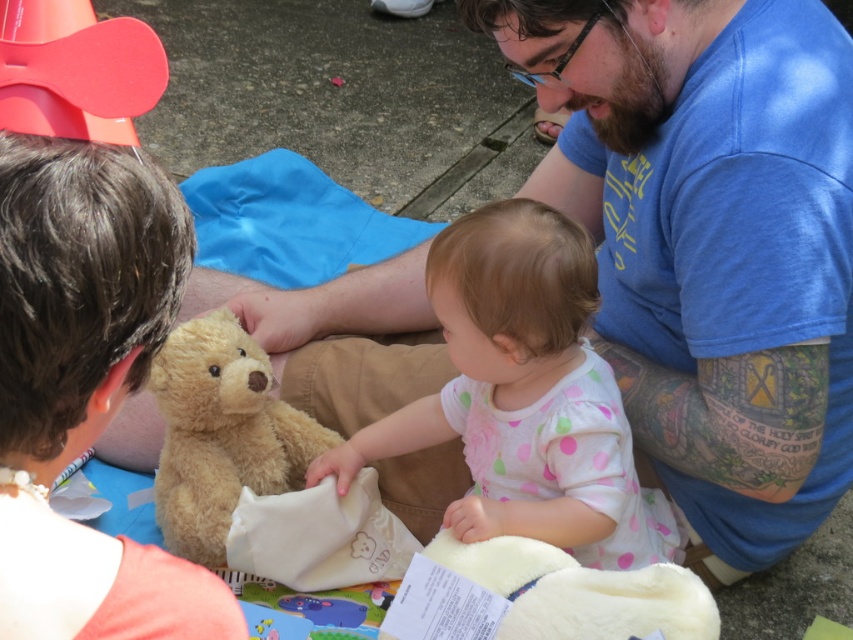
Does soft white fabric at center have a greater width compared to fuzzy beige teddy bear at center?

Yes, soft white fabric at center is wider than fuzzy beige teddy bear at center.

Does point (457, 276) lie in front of point (219, 387)?

Yes, it is in front of point (219, 387).

You are a GUI agent. You are given a task and a screenshot of the screen. Output one action in this format:
    pyautogui.click(x=<x>, y=<y>)
    Task: Click on the soft white fabric at center
    
    Given the screenshot: What is the action you would take?
    pyautogui.click(x=524, y=396)

Measure the distance between blue cotton shirt at center and camera.

blue cotton shirt at center and camera are 1.11 meters apart from each other.

What do you see at coordinates (711, 243) in the screenshot?
I see `blue cotton shirt at center` at bounding box center [711, 243].

This screenshot has height=640, width=853. I want to click on blue cotton shirt at center, so click(x=711, y=243).

This screenshot has height=640, width=853. What are the coordinates of `blue cotton shirt at center` in the screenshot? It's located at (711, 243).

How far apart are blue cotton shirt at center and fuzzy beige teddy bear at center?

blue cotton shirt at center and fuzzy beige teddy bear at center are 25.69 inches apart.

Describe the element at coordinates (711, 243) in the screenshot. I see `blue cotton shirt at center` at that location.

At what (x,y) coordinates should I click in order to perform the action: click on blue cotton shirt at center. Please return your answer as a coordinate pair (x, y). The width and height of the screenshot is (853, 640). Looking at the image, I should click on (711, 243).

At what (x,y) coordinates should I click in order to perform the action: click on blue cotton shirt at center. Please return your answer as a coordinate pair (x, y). This screenshot has width=853, height=640. Looking at the image, I should click on (711, 243).